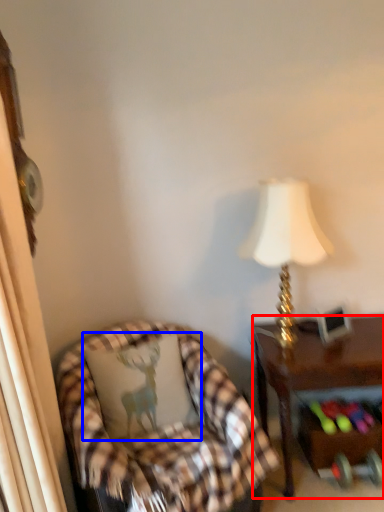
Question: Which of the following is the closest to the observer, desk (highlighted by a red box) or pillow (highlighted by a blue box)?

Choices:
 (A) desk
 (B) pillow

Answer: (B)